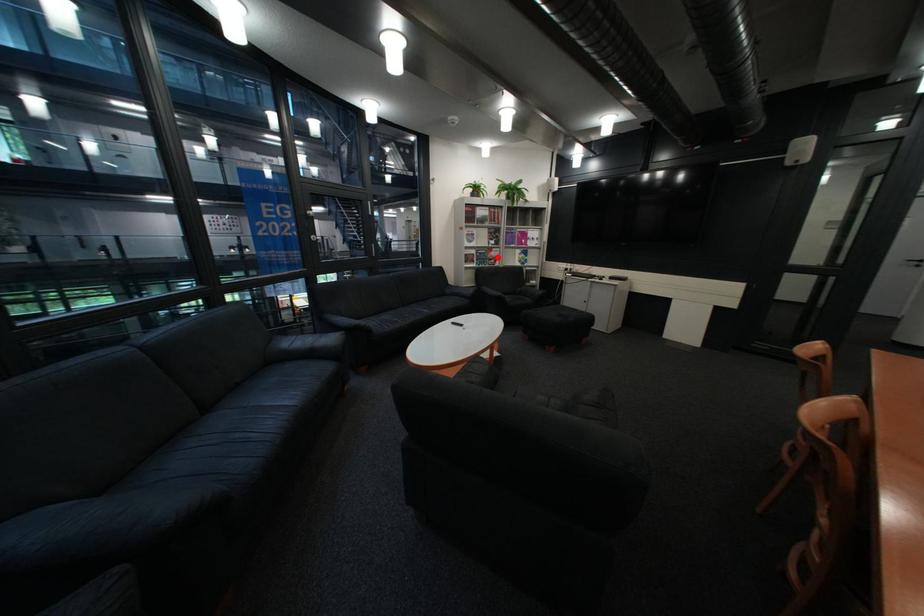
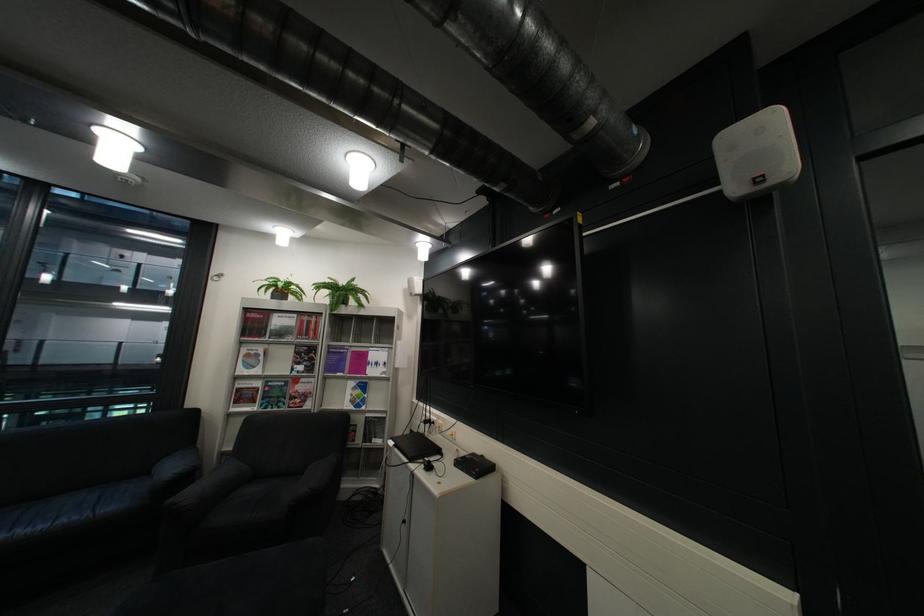
Question: I am providing you with two images of the same scene from different viewpoints. A red point is shown in image1. For the corresponding object point in image2, is it positioned nearer or farther from the camera?

Choices:
 (A) Nearer
 (B) Farther

Answer: (B)